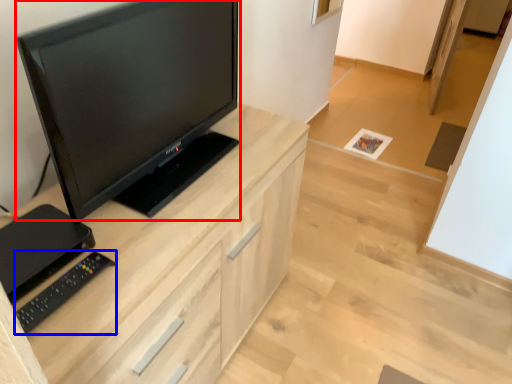
Question: Among these objects, which one is farthest to the camera, television (highlighted by a red box) or equipment (highlighted by a blue box)?

Choices:
 (A) television
 (B) equipment

Answer: (B)